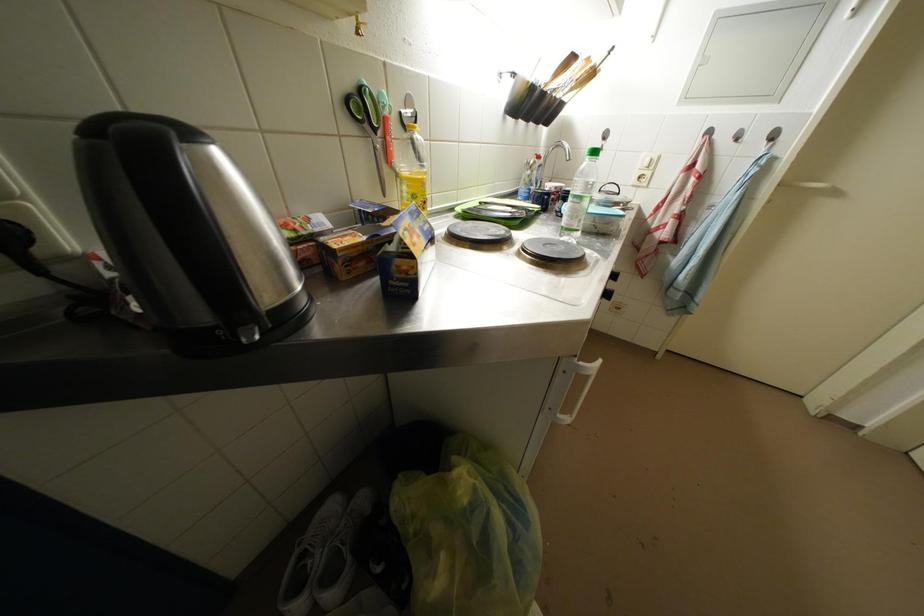
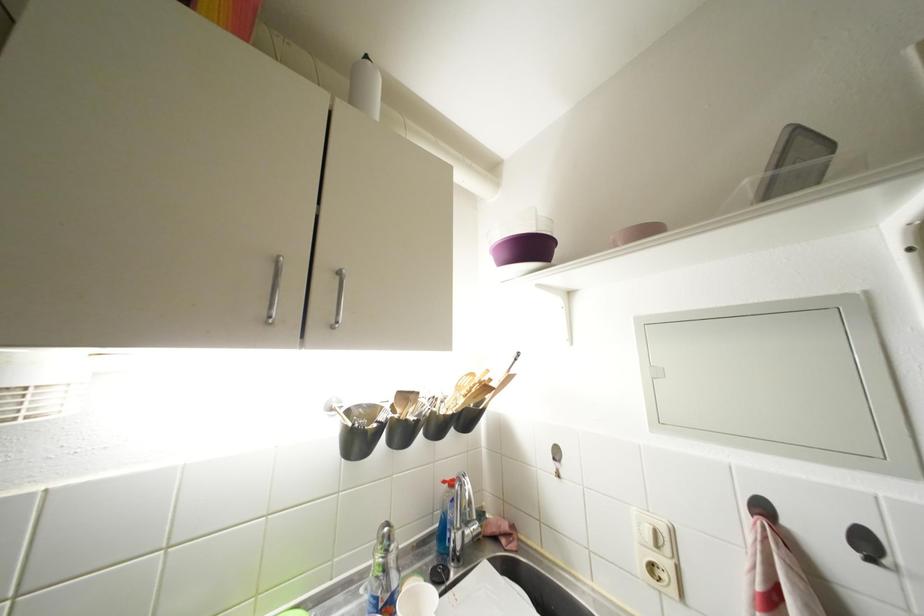
Where in the second image is the point corresponding to (545,161) from the first image?

(457, 488)